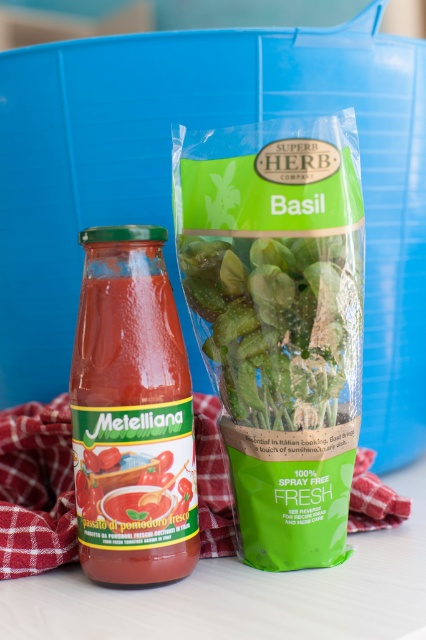
Question: Is translucent glass jar of tomato sauce at center above green leafy basil at center?

Choices:
 (A) no
 (B) yes

Answer: (A)

Question: Considering the relative positions of translucent glass jar of tomato sauce at center and green leafy basil at center in the image provided, where is translucent glass jar of tomato sauce at center located with respect to green leafy basil at center?

Choices:
 (A) above
 (B) below

Answer: (B)

Question: Which point is farther to the camera?

Choices:
 (A) (189, 380)
 (B) (213, 253)

Answer: (A)

Question: Can you confirm if translucent glass jar of tomato sauce at center is wider than green leafy basil at center?

Choices:
 (A) yes
 (B) no

Answer: (B)